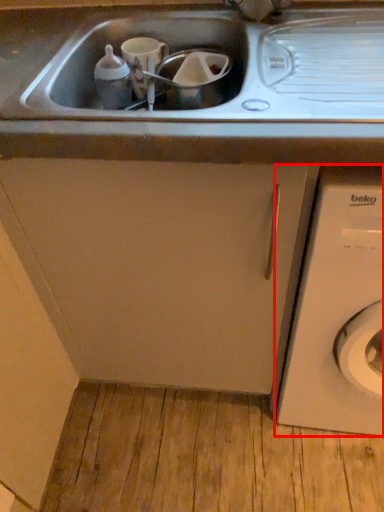
Question: From the image's perspective, where is washing machine (annotated by the red box) located in relation to cabinetry in the image?

Choices:
 (A) below
 (B) above

Answer: (A)